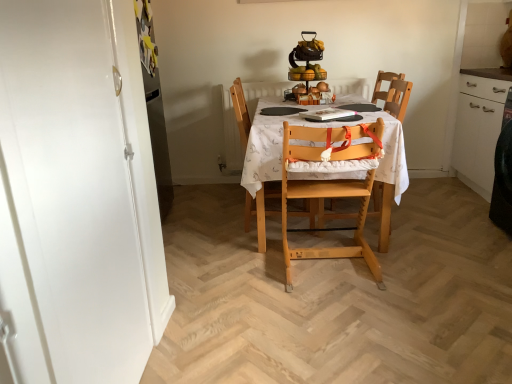
Question: From a real-world perspective, is white printed fabric at center on wooden highchair at center, marked as the first chair in a right-to-left arrangement?

Choices:
 (A) no
 (B) yes

Answer: (A)

Question: Is white printed fabric at center closer to camera compared to wooden highchair at center, arranged as the third chair when viewed from the left?

Choices:
 (A) no
 (B) yes

Answer: (B)

Question: Would you say white printed fabric at center contains wooden highchair at center, marked as the first chair in a right-to-left arrangement?

Choices:
 (A) yes
 (B) no

Answer: (A)

Question: Is white printed fabric at center completely or partially outside of wooden highchair at center, arranged as the third chair when viewed from the left?

Choices:
 (A) yes
 (B) no

Answer: (A)

Question: Is there a large distance between white printed fabric at center and wooden highchair at center, arranged as the third chair when viewed from the left?

Choices:
 (A) yes
 (B) no

Answer: (B)

Question: Considering the relative sizes of white printed fabric at center and wooden highchair at center, arranged as the third chair when viewed from the left, in the image provided, is white printed fabric at center taller than wooden highchair at center, arranged as the third chair when viewed from the left,?

Choices:
 (A) yes
 (B) no

Answer: (B)

Question: Considering the relative sizes of light wood highchair at center, which is counted as the second chair, starting from the left, and wooden chair with cushion at center, acting as the third chair starting from the right, in the image provided, is light wood highchair at center, which is counted as the second chair, starting from the left, wider than wooden chair with cushion at center, acting as the third chair starting from the right,?

Choices:
 (A) yes
 (B) no

Answer: (B)

Question: Does light wood highchair at center, acting as the 2th chair starting from the right, appear on the right side of wooden chair with cushion at center, the 1th chair in the left-to-right sequence?

Choices:
 (A) no
 (B) yes

Answer: (B)

Question: Are light wood highchair at center, which is counted as the second chair, starting from the left, and wooden chair with cushion at center, acting as the third chair starting from the right, far apart?

Choices:
 (A) yes
 (B) no

Answer: (B)

Question: Considering the relative sizes of light wood highchair at center, acting as the 2th chair starting from the right, and wooden chair with cushion at center, acting as the third chair starting from the right, in the image provided, is light wood highchair at center, acting as the 2th chair starting from the right, shorter than wooden chair with cushion at center, acting as the third chair starting from the right,?

Choices:
 (A) no
 (B) yes

Answer: (B)

Question: Considering the relative positions of light wood highchair at center, which is counted as the second chair, starting from the left, and wooden chair with cushion at center, acting as the third chair starting from the right, in the image provided, is light wood highchair at center, which is counted as the second chair, starting from the left, in front of wooden chair with cushion at center, acting as the third chair starting from the right,?

Choices:
 (A) yes
 (B) no

Answer: (A)

Question: Can you confirm if light wood highchair at center, which is counted as the second chair, starting from the left, is thinner than wooden chair with cushion at center, the 1th chair in the left-to-right sequence?

Choices:
 (A) yes
 (B) no

Answer: (A)

Question: Would you say light wood highchair at center, which is counted as the second chair, starting from the left, contains white printed fabric at center?

Choices:
 (A) yes
 (B) no

Answer: (B)